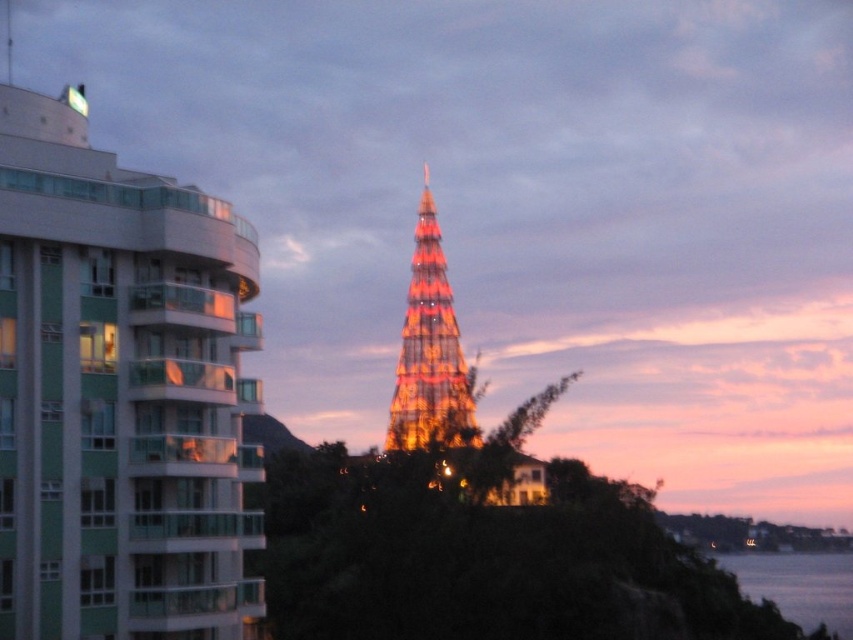
Does white glossy building at left have a larger size compared to transparent water at lower right?

No.

Which is more to the right, white glossy building at left or transparent water at lower right?

transparent water at lower right

This screenshot has height=640, width=853. What do you see at coordinates (119, 392) in the screenshot?
I see `white glossy building at left` at bounding box center [119, 392].

You are a GUI agent. You are given a task and a screenshot of the screen. Output one action in this format:
    pyautogui.click(x=<x>, y=<y>)
    Task: Click on the white glossy building at left
    
    Given the screenshot: What is the action you would take?
    pyautogui.click(x=119, y=392)

Which of these two, white glossy building at left or illuminated glass eiffel tower at center, stands taller?

illuminated glass eiffel tower at center

Can you confirm if white glossy building at left is thinner than illuminated glass eiffel tower at center?

Correct, white glossy building at left's width is less than illuminated glass eiffel tower at center's.

Is point (45, 285) behind point (402, 356)?

No, it is in front of (402, 356).

Where is `white glossy building at left`? The image size is (853, 640). white glossy building at left is located at coordinates (119, 392).

Is illuminated glass eiffel tower at center to the right of transparent water at lower right from the viewer's perspective?

In fact, illuminated glass eiffel tower at center is to the left of transparent water at lower right.

Is illuminated glass eiffel tower at center to the left of transparent water at lower right from the viewer's perspective?

Yes, illuminated glass eiffel tower at center is to the left of transparent water at lower right.

Where is `illuminated glass eiffel tower at center`? The image size is (853, 640). illuminated glass eiffel tower at center is located at coordinates (428, 349).